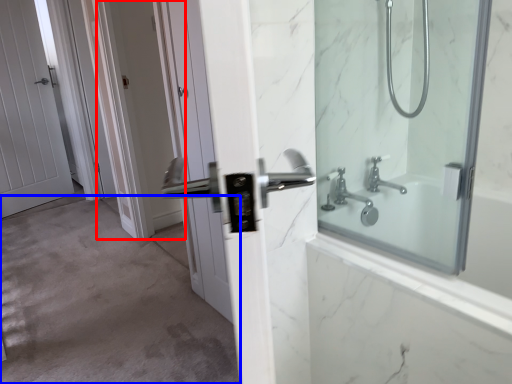
Question: Which object appears closest to the camera in this image, screen door (highlighted by a red box) or corridor (highlighted by a blue box)?

Choices:
 (A) screen door
 (B) corridor

Answer: (B)